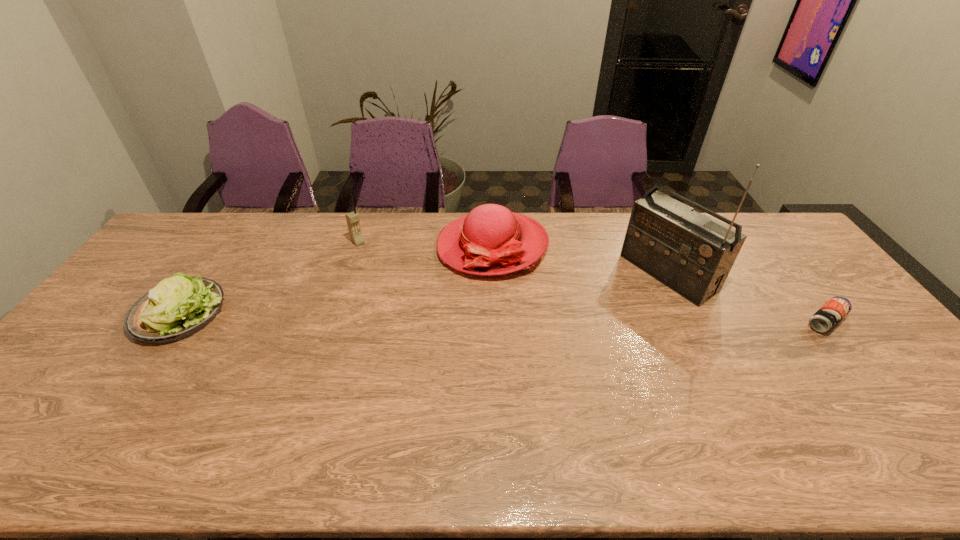
Find the location of `the leftmost object`. the leftmost object is located at coordinates (178, 307).

This screenshot has width=960, height=540. In order to click on lettuce in this screenshot , I will do `click(178, 307)`.

Where is `the shortest object`? the shortest object is located at coordinates (830, 314).

At what (x,y) coordinates should I click in order to perform the action: click on beer can. Please return your answer as a coordinate pair (x, y). This screenshot has height=540, width=960. Looking at the image, I should click on (830, 314).

Find the location of a particular element. the tallest object is located at coordinates (692, 254).

Where is `radio receiver`? radio receiver is located at coordinates (692, 254).

Find the location of a particular element. the third shortest object is located at coordinates (491, 240).

You are a GUI agent. You are given a task and a screenshot of the screen. Output one action in this format:
    pyautogui.click(x=<x>, y=<y>)
    Task: Click on the hat
    The height and width of the screenshot is (540, 960).
    Given the screenshot: What is the action you would take?
    pyautogui.click(x=491, y=240)

In order to click on the fourth object from right to left in this screenshot , I will do `click(352, 218)`.

This screenshot has height=540, width=960. I want to click on cellular telephone, so click(x=352, y=218).